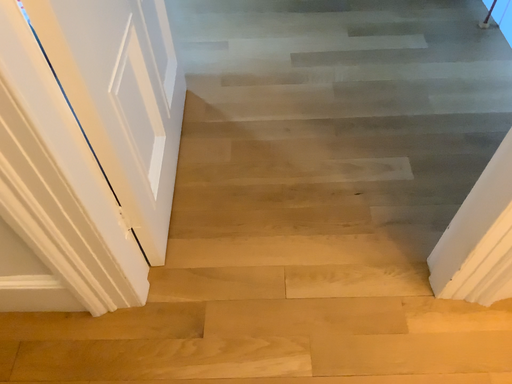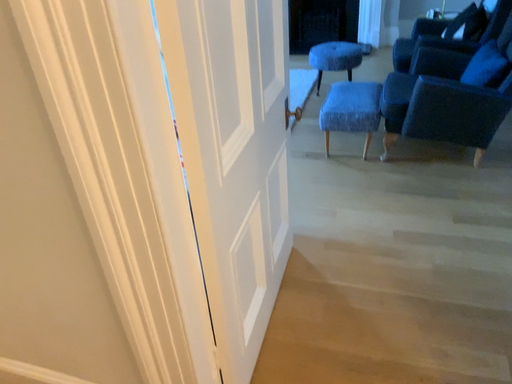
Question: How did the camera likely rotate when shooting the video?

Choices:
 (A) rotated downward
 (B) rotated upward

Answer: (B)